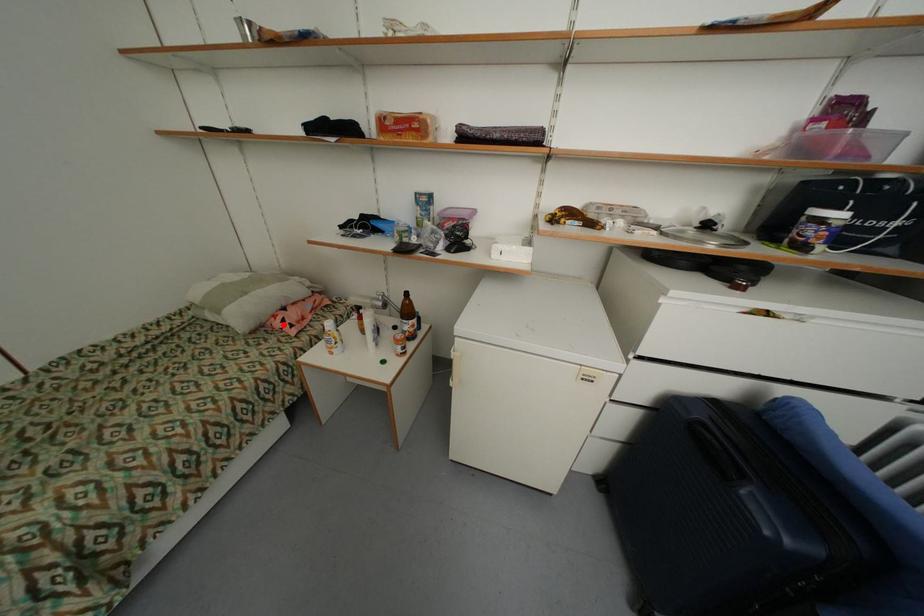
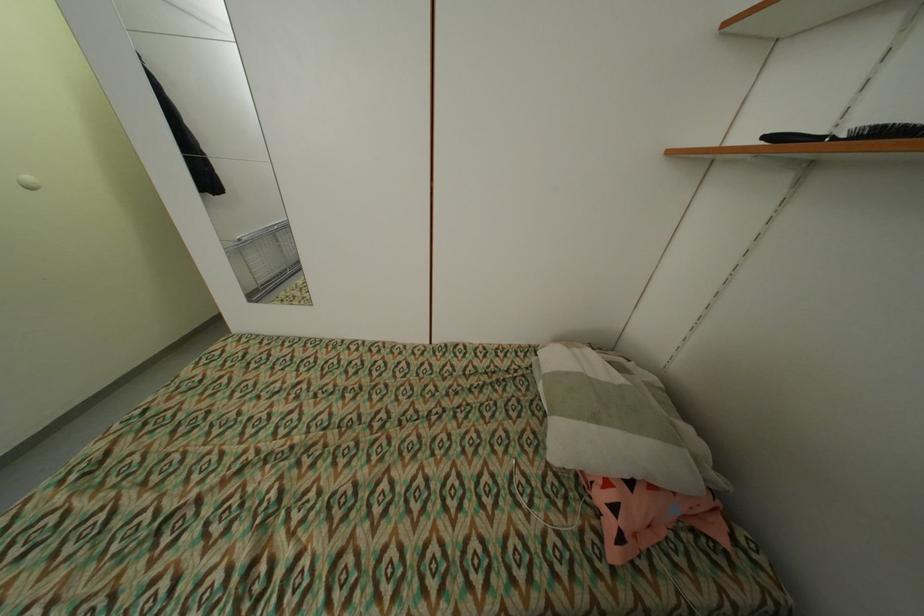
In the second image, find the point that corresponds to the highlighted location in the first image.

(606, 498)